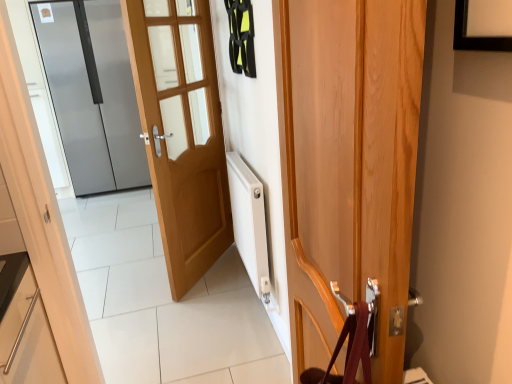
Question: Is light brown wood door at center, the 2th door viewed from the right, far away from satin silver refrigerator at left, the third door from the right?

Choices:
 (A) no
 (B) yes

Answer: (B)

Question: Does light brown wood door at center, positioned as the 2th door in back-to-front order, have a lesser width compared to satin silver refrigerator at left, which is the first door from left to right?

Choices:
 (A) yes
 (B) no

Answer: (A)

Question: Is satin silver refrigerator at left, which is the first door from left to right, at the back of light brown wood door at center, which is counted as the 2th door, starting from the front?

Choices:
 (A) no
 (B) yes

Answer: (A)

Question: From a real-world perspective, is light brown wood door at center, which ranks as the 2th door in left-to-right order, beneath satin silver refrigerator at left, the 1th door in the back-to-front sequence?

Choices:
 (A) yes
 (B) no

Answer: (A)

Question: Is light brown wood door at center, which ranks as the 2th door in left-to-right order, shorter than satin silver refrigerator at left, acting as the 3th door starting from the front?

Choices:
 (A) no
 (B) yes

Answer: (B)

Question: Would you say wooden door at center, the 1th door in the front-to-back sequence, is to the left or to the right of light brown wood door at center, which is counted as the 2th door, starting from the front, in the picture?

Choices:
 (A) right
 (B) left

Answer: (A)

Question: Looking at their shapes, would you say wooden door at center, the 3th door viewed from the left, is wider or thinner than light brown wood door at center, which ranks as the 2th door in left-to-right order?

Choices:
 (A) thin
 (B) wide

Answer: (B)

Question: Is wooden door at center, the 3th door viewed from the left, taller or shorter than light brown wood door at center, the 2th door viewed from the right?

Choices:
 (A) tall
 (B) short

Answer: (B)

Question: From the image's perspective, is wooden door at center, acting as the first door starting from the right, above or below light brown wood door at center, positioned as the 2th door in back-to-front order?

Choices:
 (A) below
 (B) above

Answer: (A)

Question: Would you say satin silver refrigerator at left, the third door from the right, is inside or outside wooden door at center, acting as the first door starting from the right?

Choices:
 (A) outside
 (B) inside

Answer: (A)

Question: Is point (75, 54) closer or farther from the camera than point (336, 19)?

Choices:
 (A) farther
 (B) closer

Answer: (A)

Question: From their relative heights in the image, would you say satin silver refrigerator at left, acting as the 3th door starting from the front, is taller or shorter than wooden door at center, the 1th door in the front-to-back sequence?

Choices:
 (A) tall
 (B) short

Answer: (A)

Question: From the image's perspective, relative to wooden door at center, the 1th door in the front-to-back sequence, is satin silver refrigerator at left, acting as the 3th door starting from the front, above or below?

Choices:
 (A) above
 (B) below

Answer: (A)

Question: Considering the positions of light brown wood door at center, which is counted as the 2th door, starting from the front, and satin silver refrigerator at left, the 1th door in the back-to-front sequence, in the image, is light brown wood door at center, which is counted as the 2th door, starting from the front, taller or shorter than satin silver refrigerator at left, the 1th door in the back-to-front sequence,?

Choices:
 (A) short
 (B) tall

Answer: (A)

Question: Is light brown wood door at center, which is counted as the 2th door, starting from the front, bigger or smaller than satin silver refrigerator at left, the 1th door in the back-to-front sequence?

Choices:
 (A) big
 (B) small

Answer: (B)